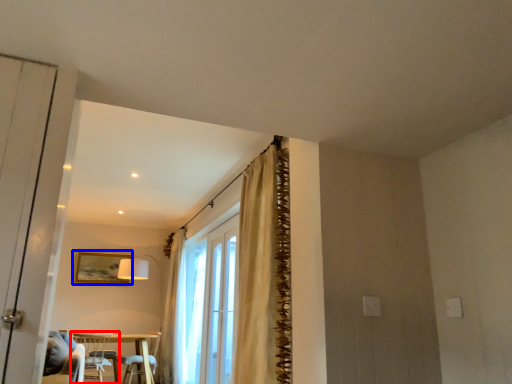
Question: Among these objects, which one is nearest to the camera, chair (highlighted by a red box) or picture frame (highlighted by a blue box)?

Choices:
 (A) chair
 (B) picture frame

Answer: (A)